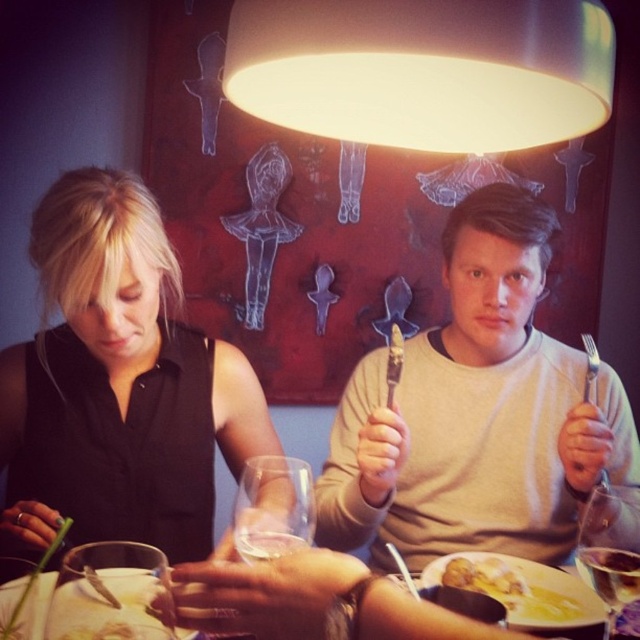
Between black matte dress at center and yellow creamy soup at lower center, which one appears on the right side from the viewer's perspective?

yellow creamy soup at lower center is more to the right.

Is the position of black matte dress at center less distant than that of yellow creamy soup at lower center?

Yes, black matte dress at center is closer to the viewer.

Who is more distant from viewer, [10,401] or [572,625]?

Point [10,401]

What are the coordinates of `black matte dress at center` in the screenshot? It's located at (118, 384).

Is black matte dress at center wider than clear glass wine glass at lower left?

Yes.

Who is positioned more to the right, black matte dress at center or clear glass wine glass at lower left?

clear glass wine glass at lower left is more to the right.

Between point (52, 291) and point (77, 586), which one is positioned behind?

Point (52, 291)

Where is `black matte dress at center`? black matte dress at center is located at coordinates (118, 384).

Can you confirm if matte beige sweater at center is wider than transparent glass at lower right?

Indeed, matte beige sweater at center has a greater width compared to transparent glass at lower right.

Find the location of a particular element. The width and height of the screenshot is (640, 640). matte beige sweater at center is located at coordinates (476, 412).

You are a GUI agent. You are given a task and a screenshot of the screen. Output one action in this format:
    pyautogui.click(x=<x>, y=<y>)
    Task: Click on the matte beige sweater at center
    
    Given the screenshot: What is the action you would take?
    pyautogui.click(x=476, y=412)